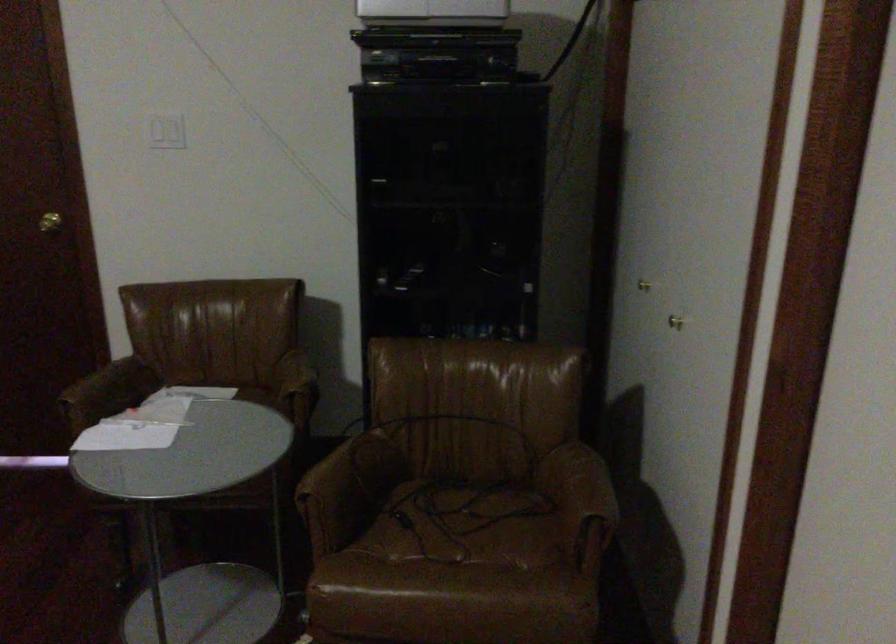
Locate an element on the screen. The image size is (896, 644). brown chair sitting surface is located at coordinates (464, 525).